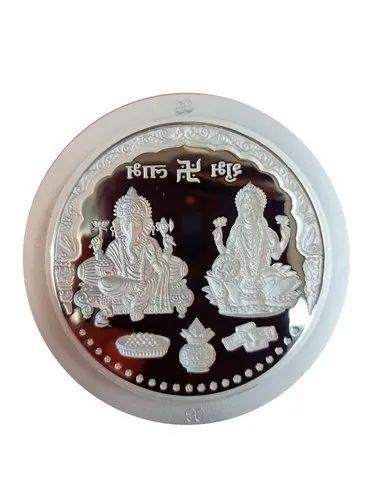
Image resolution: width=375 pixels, height=500 pixels. Identify the location of trim. (71, 220), (191, 131), (315, 241).